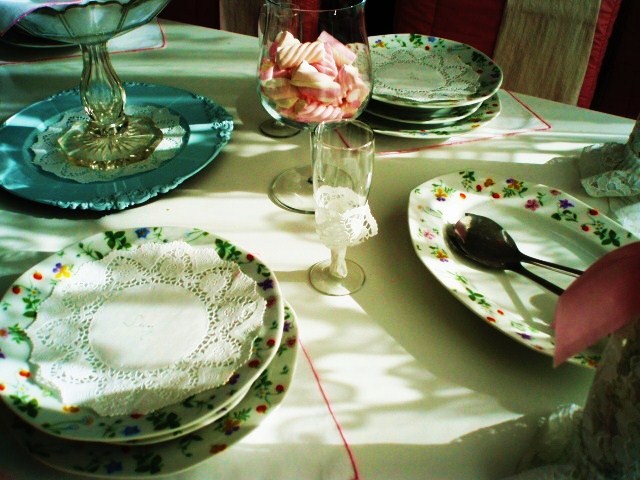
The width and height of the screenshot is (640, 480). I want to click on plates, so click(x=187, y=417), click(x=195, y=427), click(x=205, y=434), click(x=505, y=294), click(x=449, y=133), click(x=435, y=116), click(x=410, y=102), click(x=209, y=147).